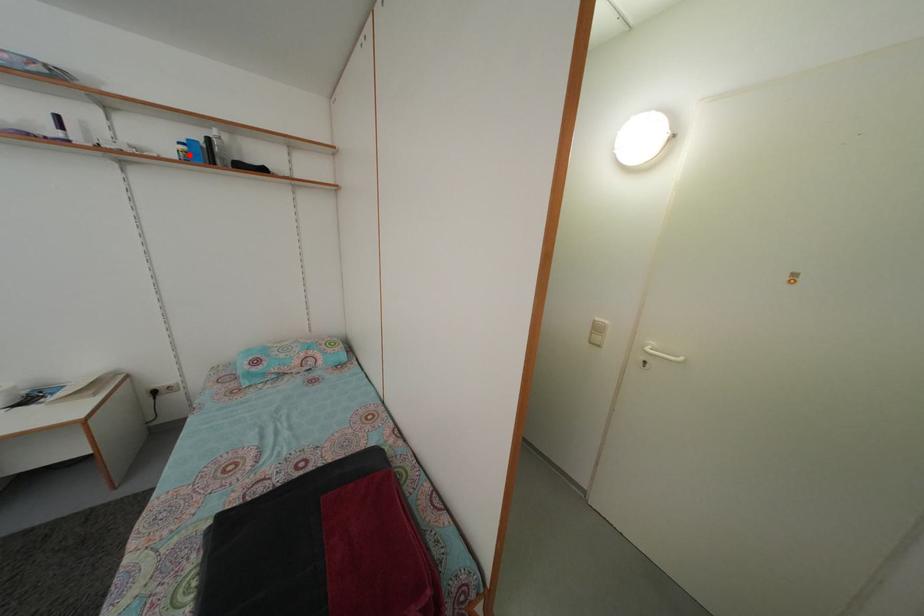
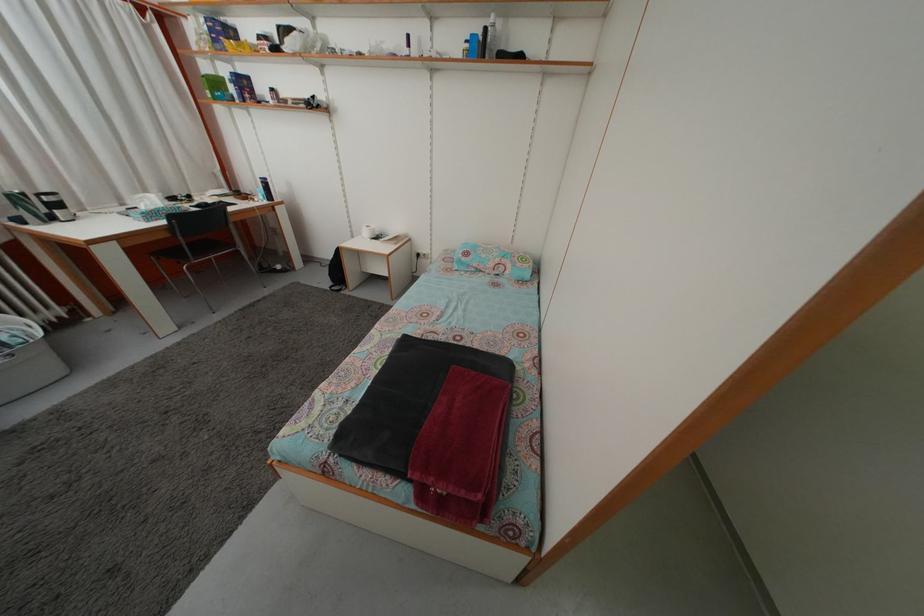
In the second image, find the point that corresponds to the highlighted location in the first image.

(473, 53)